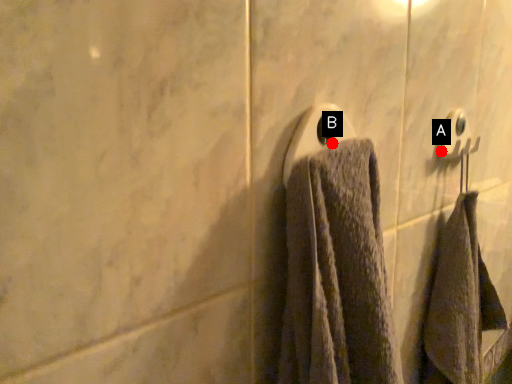
Question: Two points are circled on the image, labeled by A and B beside each circle. Among these points, which one is farthest from the camera?

Choices:
 (A) A is further
 (B) B is further

Answer: (A)